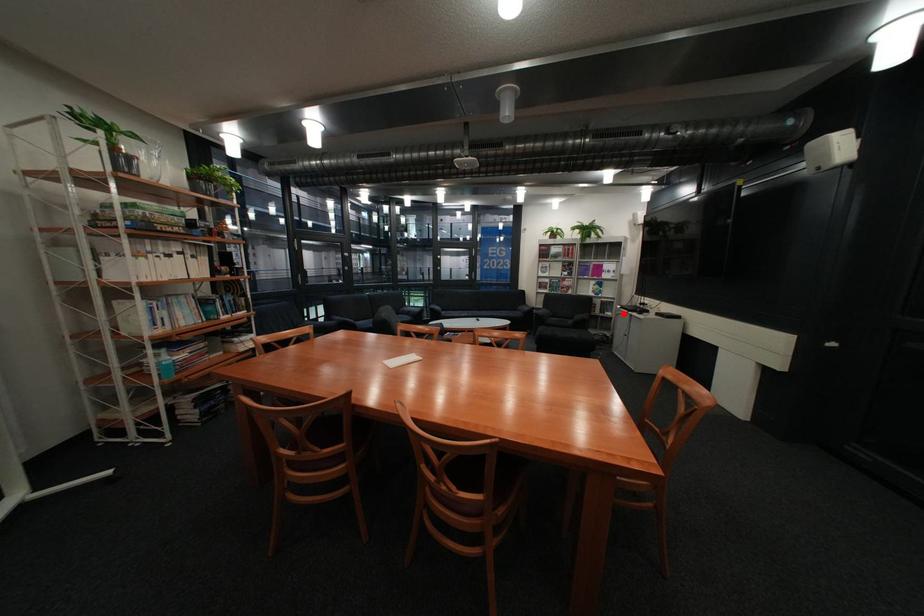
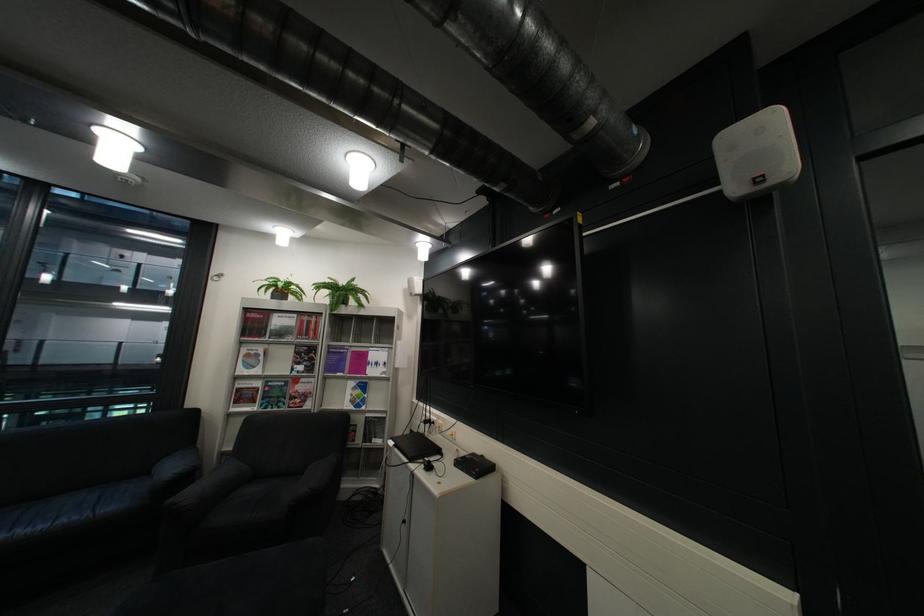
Question: I am providing you with two images of the same scene from different viewpoints. In image1, a red point is highlighted. Considering the same 3D point in image2, which of the following is correct?

Choices:
 (A) It is closer
 (B) It is farther

Answer: (B)